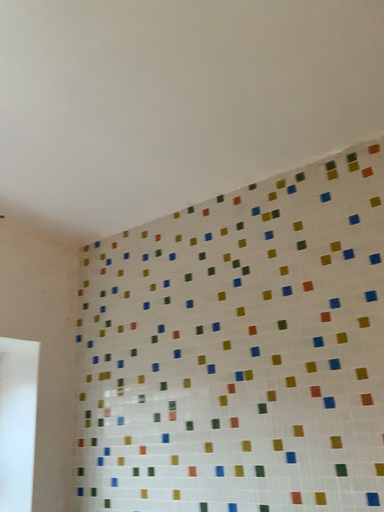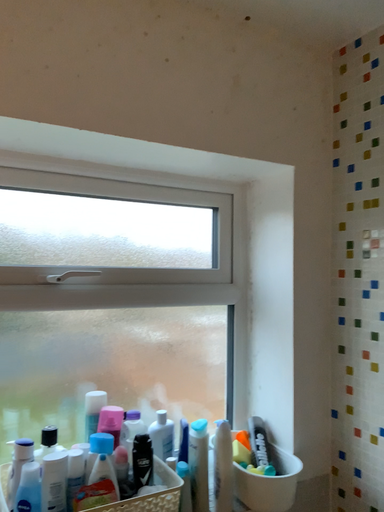
Question: How did the camera likely rotate when shooting the video?

Choices:
 (A) rotated left
 (B) rotated right

Answer: (A)